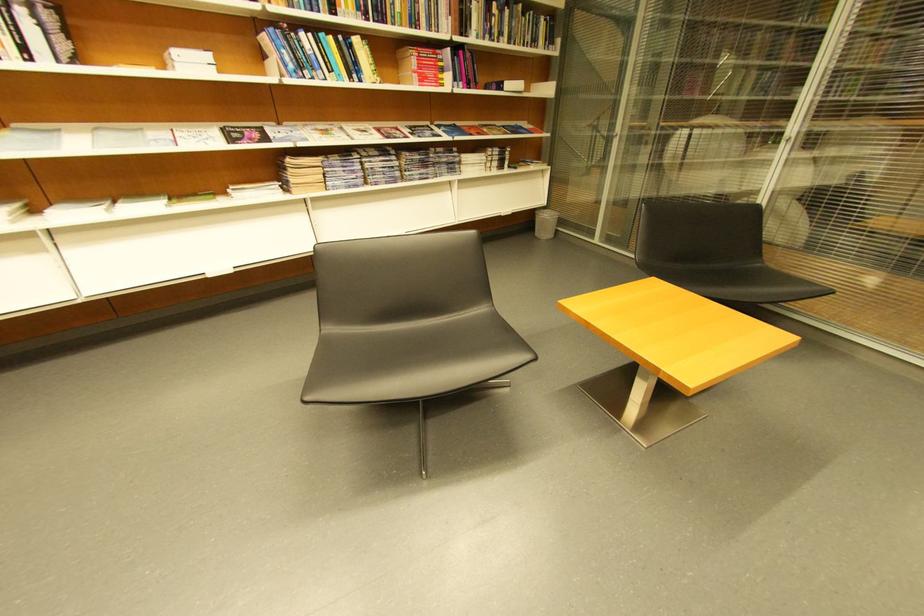
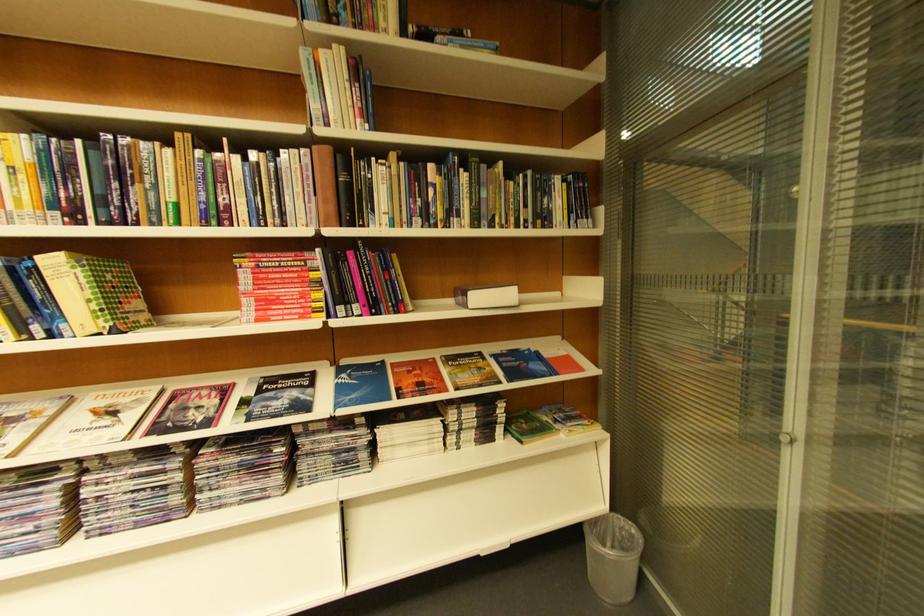
In the second image, find the point that corresponds to pixel 400 130 in the first image.

(224, 389)